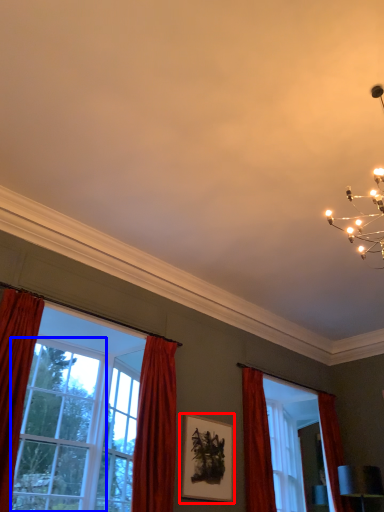
Question: Which object is further to the camera taking this photo, picture frame (highlighted by a red box) or window (highlighted by a blue box)?

Choices:
 (A) picture frame
 (B) window

Answer: (A)